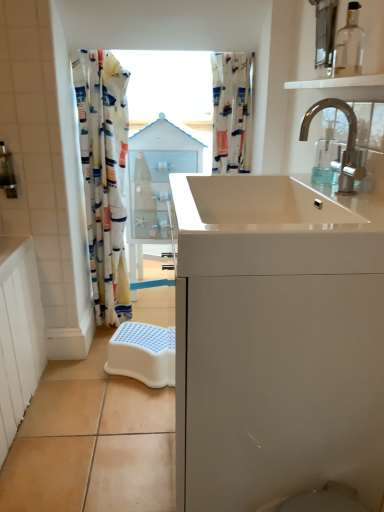
Question: Is transparent glass shelf at upper right shorter than chrome metallic faucet at upper right?

Choices:
 (A) no
 (B) yes

Answer: (B)

Question: Is transparent glass shelf at upper right outside of chrome metallic faucet at upper right?

Choices:
 (A) yes
 (B) no

Answer: (A)

Question: Does transparent glass shelf at upper right have a lesser width compared to chrome metallic faucet at upper right?

Choices:
 (A) no
 (B) yes

Answer: (B)

Question: Would you say transparent glass shelf at upper right is a long distance from chrome metallic faucet at upper right?

Choices:
 (A) yes
 (B) no

Answer: (B)

Question: Is transparent glass shelf at upper right wider than chrome metallic faucet at upper right?

Choices:
 (A) no
 (B) yes

Answer: (A)

Question: Does transparent glass shelf at upper right have a larger size compared to chrome metallic faucet at upper right?

Choices:
 (A) yes
 (B) no

Answer: (B)

Question: Does white glossy medicine cabinet at center contain clear plastic soap dispenser at upper right?

Choices:
 (A) no
 (B) yes

Answer: (A)

Question: Is white glossy medicine cabinet at center thinner than clear plastic soap dispenser at upper right?

Choices:
 (A) no
 (B) yes

Answer: (A)

Question: Does white glossy medicine cabinet at center have a smaller size compared to clear plastic soap dispenser at upper right?

Choices:
 (A) no
 (B) yes

Answer: (A)

Question: Considering the relative positions of white glossy medicine cabinet at center and clear plastic soap dispenser at upper right in the image provided, is white glossy medicine cabinet at center in front of clear plastic soap dispenser at upper right?

Choices:
 (A) no
 (B) yes

Answer: (A)

Question: Can you confirm if white glossy medicine cabinet at center is wider than clear plastic soap dispenser at upper right?

Choices:
 (A) yes
 (B) no

Answer: (A)

Question: Does white glossy medicine cabinet at center come behind clear plastic soap dispenser at upper right?

Choices:
 (A) no
 (B) yes

Answer: (B)

Question: From a real-world perspective, does white fabric shower curtain at upper center stand above transparent glass bottle at upper right?

Choices:
 (A) yes
 (B) no

Answer: (B)